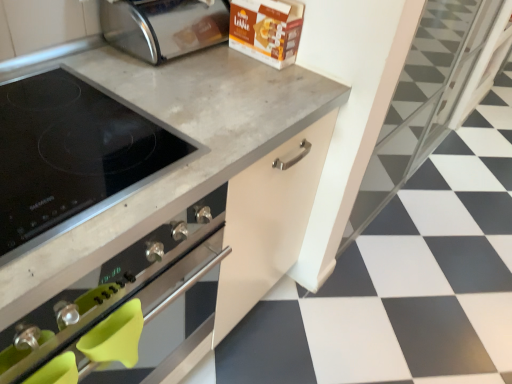
Question: Would you consider black glass cooktop at upper left to be distant from black matte stovetop at center?

Choices:
 (A) yes
 (B) no

Answer: (B)

Question: Does black glass cooktop at upper left appear on the right side of black matte stovetop at center?

Choices:
 (A) yes
 (B) no

Answer: (A)

Question: Does black glass cooktop at upper left turn towards black matte stovetop at center?

Choices:
 (A) yes
 (B) no

Answer: (B)

Question: From a real-world perspective, is black glass cooktop at upper left over black matte stovetop at center?

Choices:
 (A) yes
 (B) no

Answer: (A)

Question: Does black glass cooktop at upper left have a greater width compared to black matte stovetop at center?

Choices:
 (A) yes
 (B) no

Answer: (B)

Question: Is black glass cooktop at upper left to the left or to the right of white glossy tile at center in the image?

Choices:
 (A) right
 (B) left

Answer: (B)

Question: Considering the positions of black glass cooktop at upper left and white glossy tile at center in the image, is black glass cooktop at upper left bigger or smaller than white glossy tile at center?

Choices:
 (A) big
 (B) small

Answer: (B)

Question: Is black glass cooktop at upper left in front of or behind white glossy tile at center in the image?

Choices:
 (A) front
 (B) behind

Answer: (A)

Question: Choose the correct answer: Is black glass cooktop at upper left inside white glossy tile at center or outside it?

Choices:
 (A) inside
 (B) outside

Answer: (B)

Question: Based on their positions, is black glass cooktop at upper left located to the left or right of black matte stovetop at center?

Choices:
 (A) right
 (B) left

Answer: (A)

Question: Which is correct: black glass cooktop at upper left is inside black matte stovetop at center, or outside of it?

Choices:
 (A) inside
 (B) outside

Answer: (B)

Question: Is black glass cooktop at upper left taller or shorter than black matte stovetop at center?

Choices:
 (A) tall
 (B) short

Answer: (B)

Question: Is black glass cooktop at upper left bigger or smaller than black matte stovetop at center?

Choices:
 (A) big
 (B) small

Answer: (B)

Question: Is point (346, 340) closer or farther from the camera than point (194, 178)?

Choices:
 (A) closer
 (B) farther

Answer: (B)

Question: Considering the positions of white glossy tile at center and black matte stovetop at center in the image, is white glossy tile at center bigger or smaller than black matte stovetop at center?

Choices:
 (A) big
 (B) small

Answer: (B)